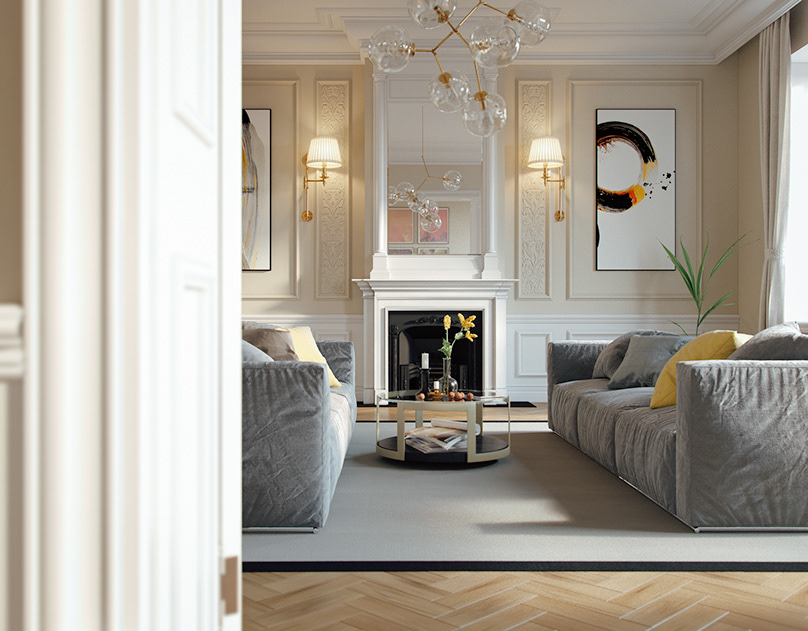
The image size is (808, 631). I want to click on wood floor, so click(417, 594).